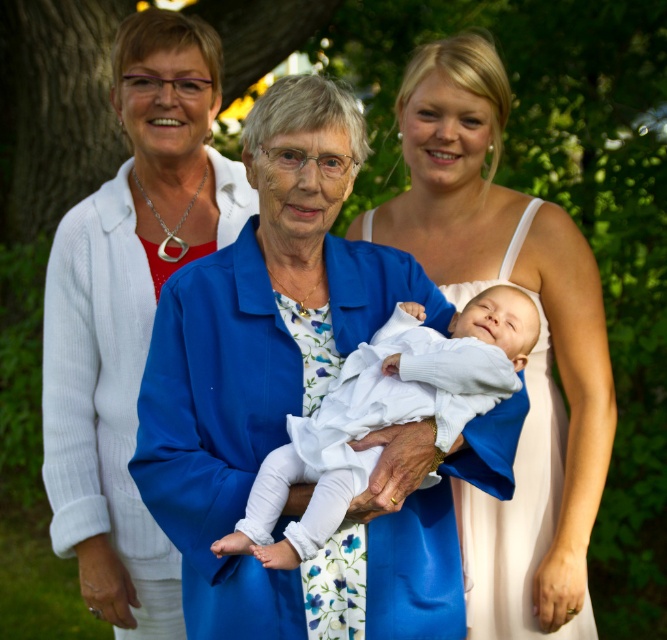
Does white soft fabric baby at center come behind white satin dress at center?

No, white soft fabric baby at center is in front of white satin dress at center.

Does white soft fabric baby at center have a smaller size compared to white satin dress at center?

Yes.

Image resolution: width=667 pixels, height=640 pixels. In order to click on white soft fabric baby at center in this screenshot , I will do [384, 413].

The image size is (667, 640). I want to click on white soft fabric baby at center, so click(384, 413).

Is point (77, 408) in front of point (424, 316)?

No, it is behind (424, 316).

Consider the image. Measure the distance between point [149,189] and camera.

Point [149,189] and camera are 3.55 meters apart.

The image size is (667, 640). I want to click on white satin jacket at left, so click(129, 310).

Is white satin jacket at left thinner than white satin dress at center?

Correct, white satin jacket at left's width is less than white satin dress at center's.

What are the coordinates of `white satin jacket at left` in the screenshot? It's located at (129, 310).